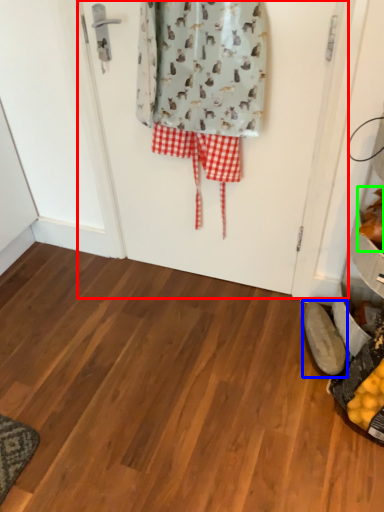
Question: Estimate the real-world distances between objects in this image. Which object is closer to screen door (highlighted by a red box), footwear (highlighted by a blue box) or food (highlighted by a green box)?

Choices:
 (A) footwear
 (B) food

Answer: (B)